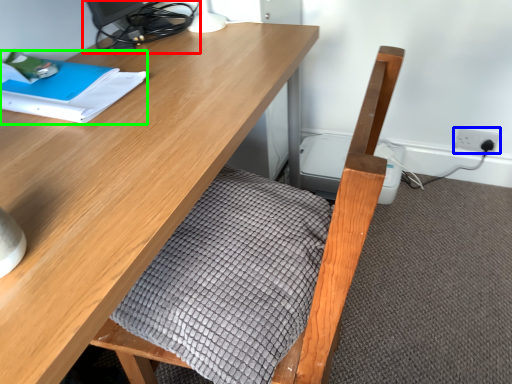
Question: Considering the real-world distances, which object is farthest from desktop (highlighted by a red box)? electric outlet (highlighted by a blue box) or notebook (highlighted by a green box)?

Choices:
 (A) electric outlet
 (B) notebook

Answer: (A)